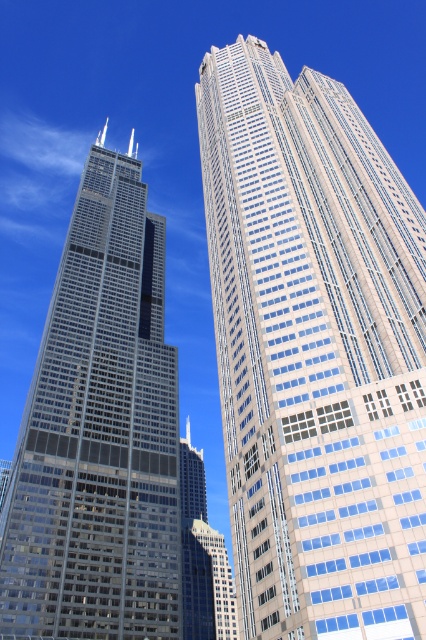
Does glassy steel skyscraper at center lie behind glassy steel skyscraper at left?

No, glassy steel skyscraper at center is in front of glassy steel skyscraper at left.

Does glassy steel skyscraper at center have a greater height compared to glassy steel skyscraper at left?

Indeed, glassy steel skyscraper at center has a greater height compared to glassy steel skyscraper at left.

The width and height of the screenshot is (426, 640). In order to click on glassy steel skyscraper at center in this screenshot , I will do `click(314, 352)`.